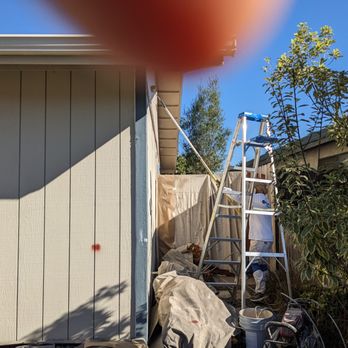
Identify the location of grayish brown drop cloth. The image size is (348, 348). (189, 306).